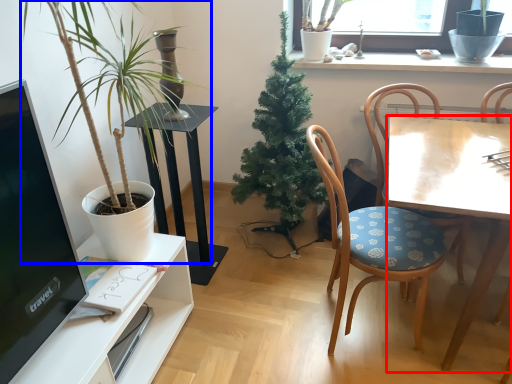
Question: Which object appears farthest to the camera in this image, desk (highlighted by a red box) or houseplant (highlighted by a blue box)?

Choices:
 (A) desk
 (B) houseplant

Answer: (A)